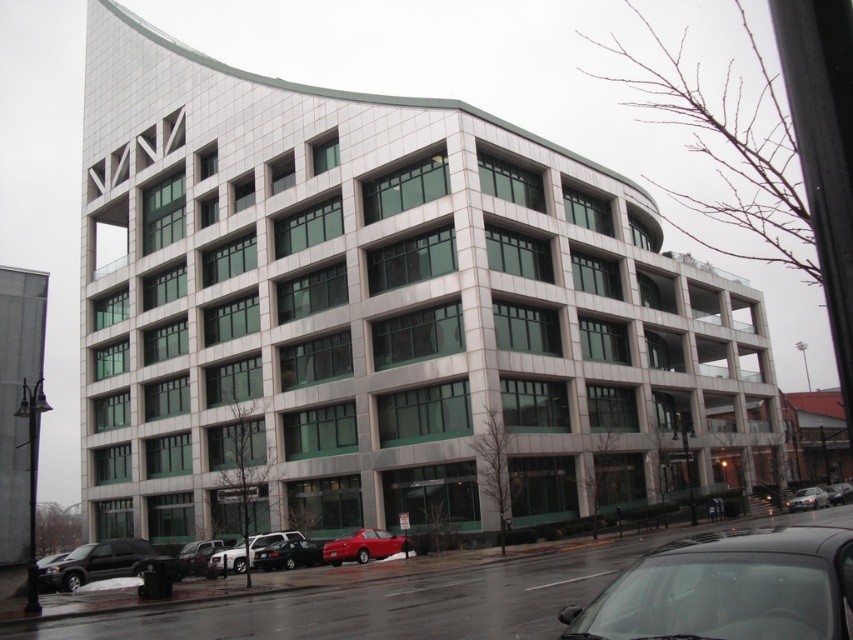
Between point (184, 557) and point (838, 484), which one is positioned behind?

The point (838, 484) is behind.

Consider the image. Who is shorter, shiny silver sedan at lower left or shiny black sedan at center?

shiny black sedan at center is shorter.

Does point (189, 570) lie behind point (844, 486)?

No, it is not.

This screenshot has width=853, height=640. Find the location of `shiny silver sedan at lower left`. shiny silver sedan at lower left is located at coordinates (196, 556).

Which of these two, shiny black car at lower right or silver metallic sedan at lower right, stands taller?

shiny black car at lower right is taller.

Who is more forward, (583, 611) or (799, 506)?

Point (583, 611) is in front.

I want to click on shiny black car at lower right, so click(728, 588).

Locate an element on the screen. shiny black car at lower right is located at coordinates coord(728,588).

The width and height of the screenshot is (853, 640). In order to click on shiny silver sedan at lower left in this screenshot , I will do `click(196, 556)`.

Does shiny silver sedan at lower left appear on the left side of silver metallic sedan at lower right?

Yes, shiny silver sedan at lower left is to the left of silver metallic sedan at lower right.

Which is in front, point (177, 561) or point (801, 502)?

Point (177, 561)

Where is `shiny silver sedan at lower left`? The image size is (853, 640). shiny silver sedan at lower left is located at coordinates (196, 556).